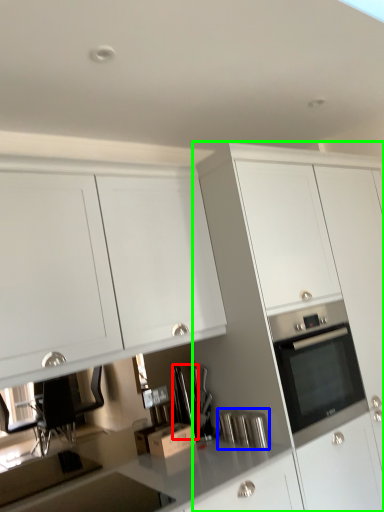
Question: Estimate the real-world distances between objects in this image. Which object is farther from appliance (highlighted by a red box), appliance (highlighted by a blue box) or cabinetry (highlighted by a green box)?

Choices:
 (A) appliance
 (B) cabinetry

Answer: (B)